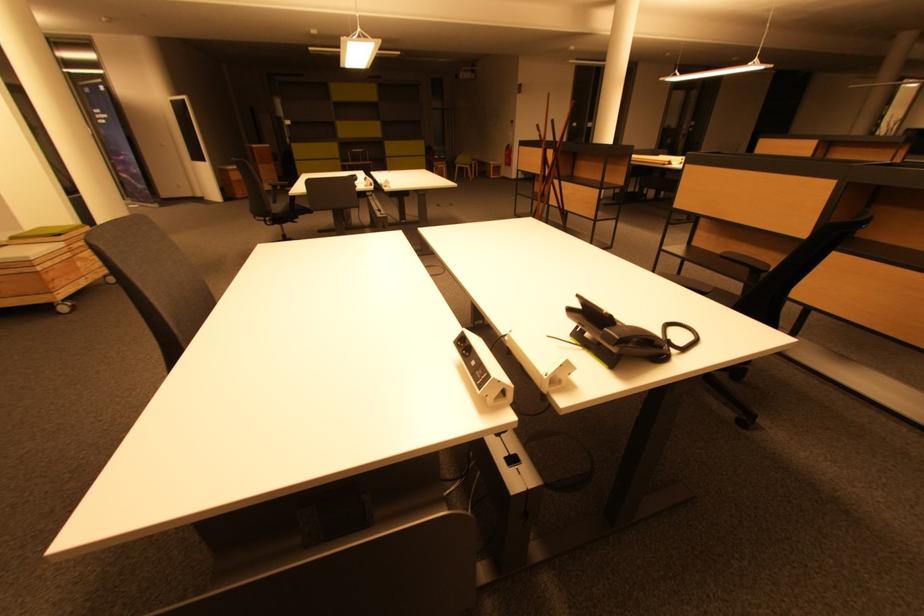
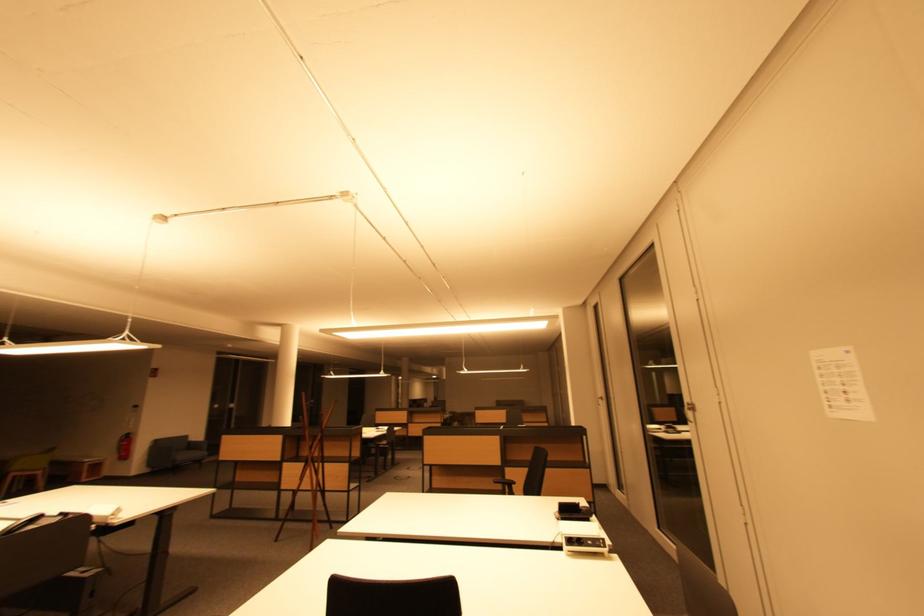
Find the pixel in the second image that matches point (513, 164) in the first image.

(128, 458)